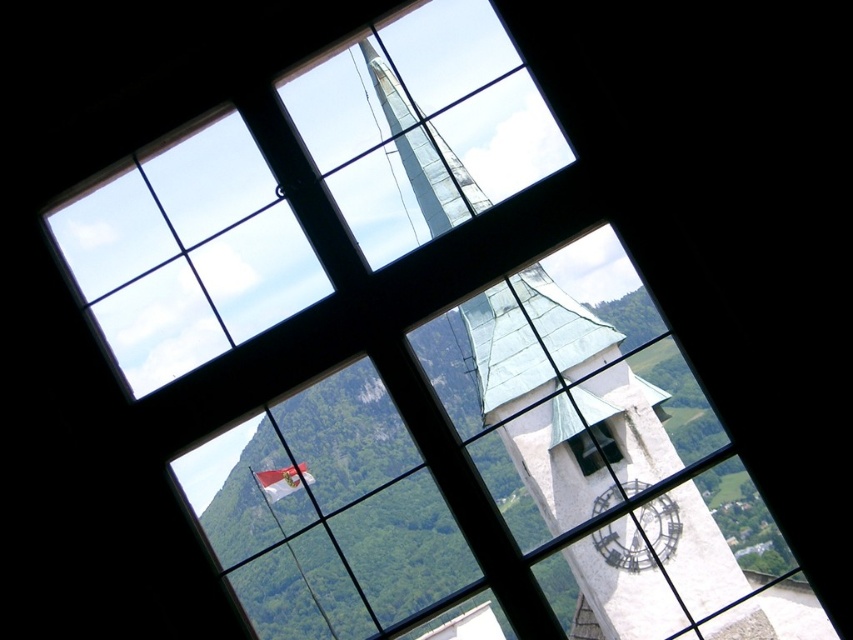
Question: Which point appears farthest from the camera in this image?

Choices:
 (A) coord(616,560)
 (B) coord(587,444)

Answer: (B)

Question: Can you confirm if metallic clock face at lower right is positioned to the right of transparent glass clock at center?

Choices:
 (A) yes
 (B) no

Answer: (A)

Question: Can you confirm if white stone clock tower at center is positioned below transparent glass clock at center?

Choices:
 (A) yes
 (B) no

Answer: (B)

Question: From the image, what is the correct spatial relationship of metallic clock face at lower right in relation to transparent glass clock at center?

Choices:
 (A) below
 (B) above

Answer: (A)

Question: Which of these objects is positioned farthest from the metallic clock face at lower right?

Choices:
 (A) white stone clock tower at center
 (B) transparent glass clock at center

Answer: (A)

Question: Among these points, which one is nearest to the camera?

Choices:
 (A) (569, 442)
 (B) (618, 552)
 (C) (738, 572)

Answer: (B)